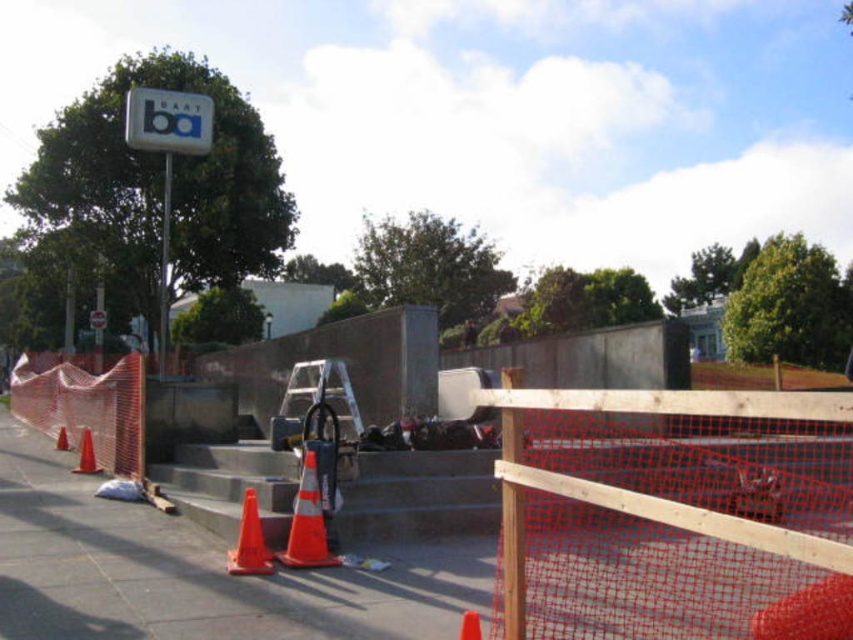
Is point (843, 630) more distant than point (152, 144)?

No, (843, 630) is closer to viewer.

Does wooden mesh fence at center have a smaller size compared to white plastic sign at upper left?

Indeed, wooden mesh fence at center has a smaller size compared to white plastic sign at upper left.

Is point (724, 627) positioned after point (157, 97)?

No, (724, 627) is closer to viewer.

I want to click on wooden mesh fence at center, so click(x=672, y=515).

Is orange matte traffic cone at lower left wider than orange plastic traffic cone at lower left?

Correct, the width of orange matte traffic cone at lower left exceeds that of orange plastic traffic cone at lower left.

Image resolution: width=853 pixels, height=640 pixels. Identify the location of orange matte traffic cone at lower left. (248, 541).

Between point (254, 506) and point (65, 436), which one is positioned behind?

Point (65, 436)

This screenshot has width=853, height=640. In order to click on orange matte traffic cone at lower left in this screenshot , I will do `click(248, 541)`.

The width and height of the screenshot is (853, 640). Identify the location of wooden mesh fence at center. tap(672, 515).

Who is more distant from viewer, [547,536] or [294,564]?

The point [547,536] is behind.

Does point (676, 444) come closer to viewer compared to point (296, 541)?

No, (676, 444) is further to viewer.

Locate an element on the screen. The width and height of the screenshot is (853, 640). wooden mesh fence at center is located at coordinates (672, 515).